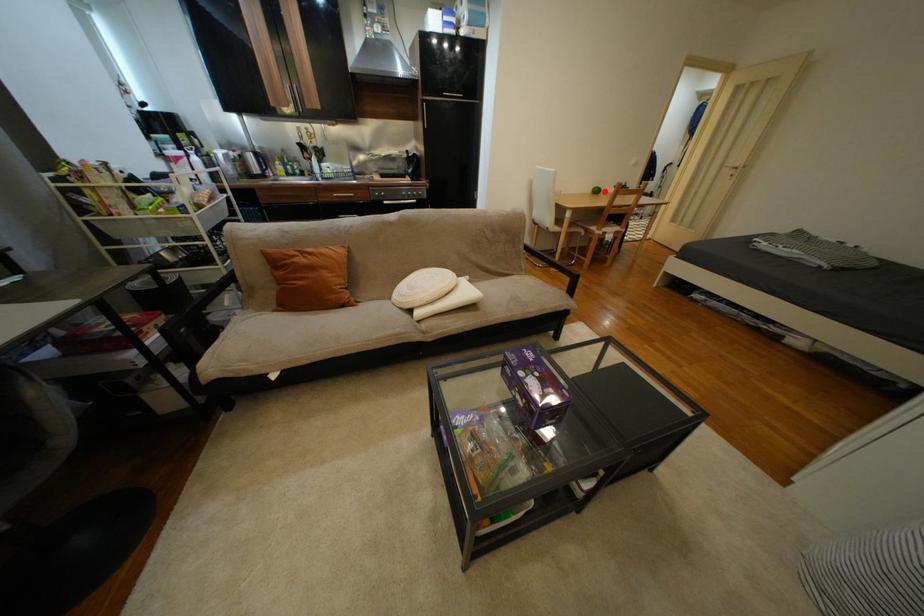
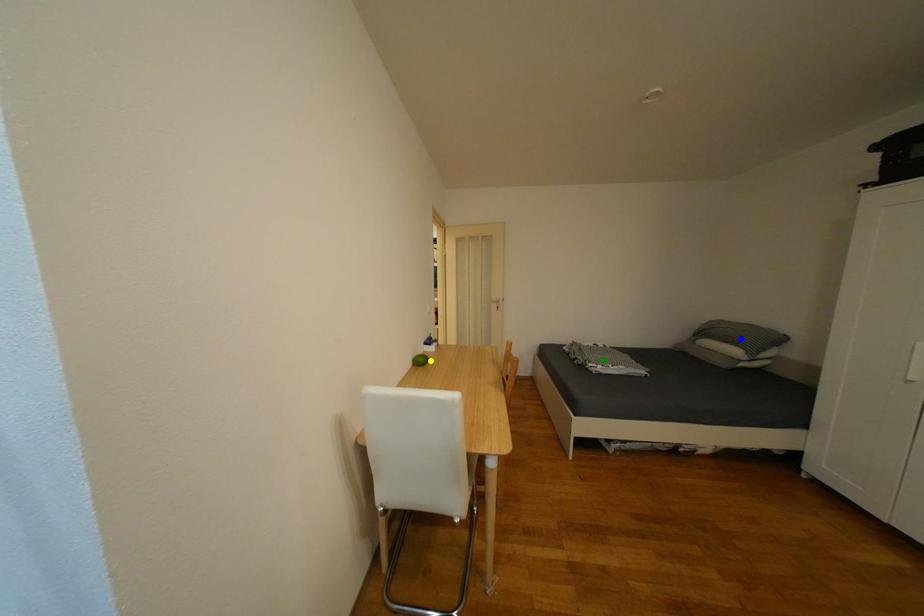
Question: I am providing you with two images of the same scene from different viewpoints. A red point is marked on the first image. You are given multiple points on the second image. Which mark in image 2 goes with the point in image 1?

Choices:
 (A) yellow point
 (B) green point
 (C) blue point

Answer: (A)